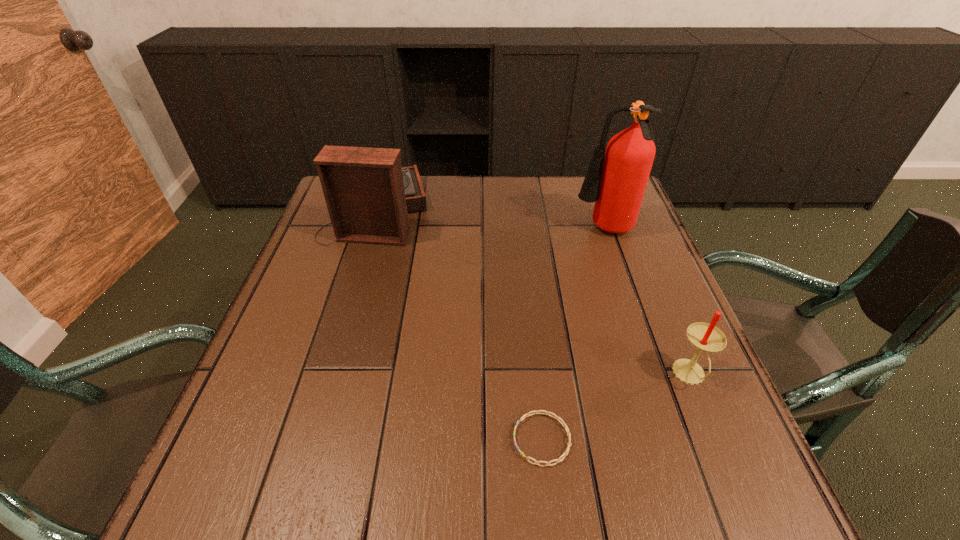
This screenshot has width=960, height=540. Find the location of `candle present at the right edge`. candle present at the right edge is located at coordinates (705, 337).

At what (x,y) coordinates should I click in order to perform the action: click on object that is at the far left corner. Please return your answer as a coordinate pair (x, y). The height and width of the screenshot is (540, 960). Looking at the image, I should click on tap(368, 194).

Locate an element on the screen. The image size is (960, 540). object positioned at the far right corner is located at coordinates (616, 179).

In the image, there is a desktop. Where is `free region at the far edge`? free region at the far edge is located at coordinates (452, 211).

Where is `vacant space at the near edge of the desktop`? vacant space at the near edge of the desktop is located at coordinates (439, 477).

The image size is (960, 540). What are the coordinates of `vacant space at the left edge of the desktop` in the screenshot? It's located at (300, 318).

The image size is (960, 540). In the image, there is a desktop. What are the coordinates of `free space at the right edge` in the screenshot? It's located at (701, 423).

Locate an element on the screen. The image size is (960, 540). free spot at the near left corner of the desktop is located at coordinates (218, 477).

This screenshot has width=960, height=540. In order to click on vacant space at the near right corner of the desktop in this screenshot , I will do `click(662, 491)`.

The height and width of the screenshot is (540, 960). I want to click on free spot between the nearest object and the leftmost object, so click(460, 325).